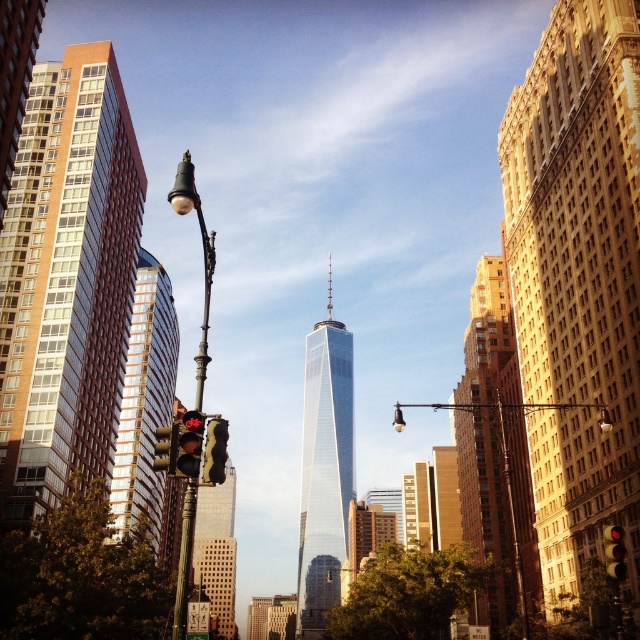
Who is taller, black glass traffic light at left or yellow matte traffic light at center?

Standing taller between the two is yellow matte traffic light at center.

Between point (204, 465) and point (621, 548), which one is positioned in front?

Point (204, 465)

Where is `black glass traffic light at left`? The image size is (640, 640). black glass traffic light at left is located at coordinates (216, 451).

Does shiny glass skyscraper at center have a lesser width compared to matte black streetlight at left?

Correct, shiny glass skyscraper at center's width is less than matte black streetlight at left's.

Which is behind, point (321, 465) or point (186, 502)?

The point (321, 465) is behind.

Identify the location of shiny glass skyscraper at center. (324, 468).

Is brown glassy building at left to the right of metallic pole at center from the viewer's perspective?

Incorrect, brown glassy building at left is not on the right side of metallic pole at center.

Is brown glassy building at left bigger than metallic pole at center?

No, brown glassy building at left is not bigger than metallic pole at center.

Where is `brown glassy building at left`? Image resolution: width=640 pixels, height=640 pixels. brown glassy building at left is located at coordinates (67, 280).